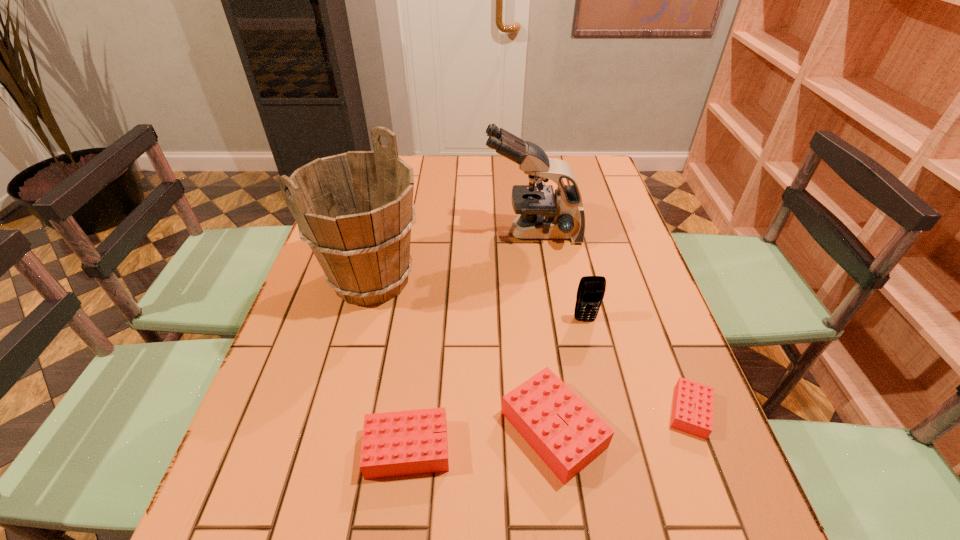
At what (x,y) coordinates should I click in order to perform the action: click on vacant space located 0.220m on the back of the rightmost object. Please return your answer as a coordinate pair (x, y). The image size is (960, 540). Looking at the image, I should click on (651, 309).

The width and height of the screenshot is (960, 540). What are the coordinates of `vacant area located 0.380m through the eyepieces of the microscope` in the screenshot? It's located at (357, 232).

Image resolution: width=960 pixels, height=540 pixels. Identify the location of free space located through the eyepieces of the microscope. (444, 232).

You are a GUI agent. You are given a task and a screenshot of the screen. Output one action in this format:
    pyautogui.click(x=<x>, y=<y>)
    Task: Click on the vacant area situated 0.200m through the eyepieces of the microscope
    The width and height of the screenshot is (960, 540).
    Given the screenshot: What is the action you would take?
    pyautogui.click(x=418, y=232)

The image size is (960, 540). Identify the location of vacant space positioned on the back of the bucket. (397, 183).

Where is `free space located 0.100m on the screen of the cellular telephone`? free space located 0.100m on the screen of the cellular telephone is located at coordinates (593, 358).

Identify the location of object that is at the left edge. The width and height of the screenshot is (960, 540). (355, 210).

I want to click on Lego situated at the right edge, so click(693, 403).

Where is `microscope present at the right edge`? This screenshot has height=540, width=960. microscope present at the right edge is located at coordinates (544, 214).

Locate an element on the screen. The image size is (960, 540). object that is positioned at the near right corner is located at coordinates (693, 403).